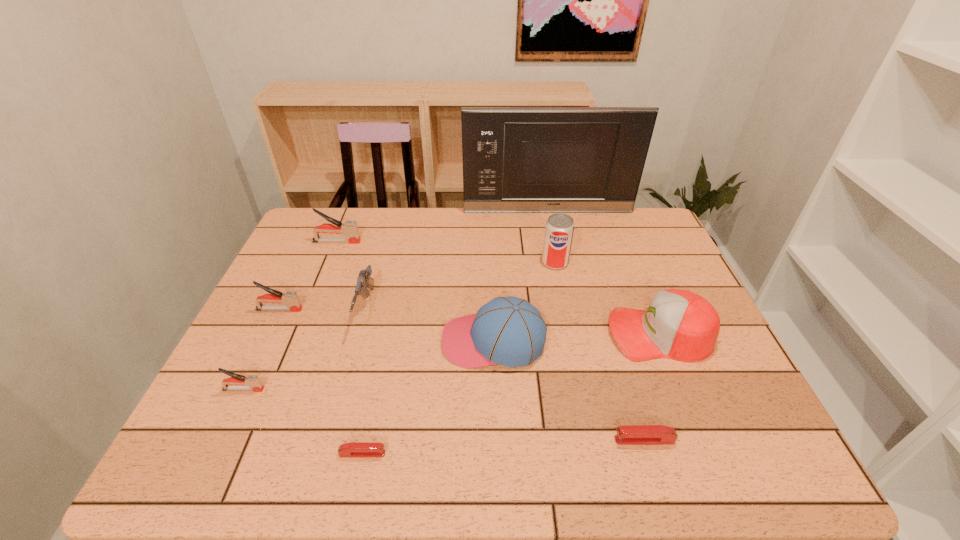
Locate an element on the screen. The width and height of the screenshot is (960, 540). free location that satisfies the following two spatial constraints: 1. on the front panel of the farthest object; 2. on the handle side of the farthest stapler is located at coordinates (554, 242).

I want to click on vacant space that satisfies the following two spatial constraints: 1. on the front panel of the microwave oven; 2. on the handle side of the fourth nearest stapler, so point(568,309).